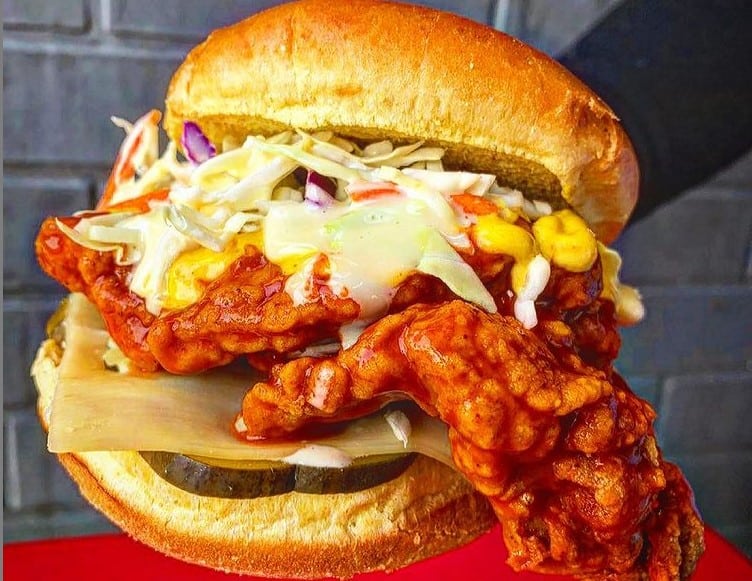
Identify the location of wall. The image size is (752, 581). (50, 134).